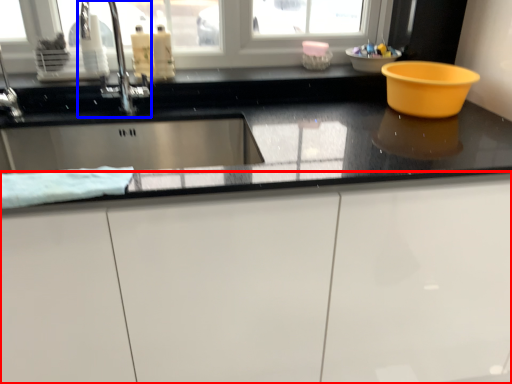
Question: Among these objects, which one is nearest to the camera, cabinetry (highlighted by a red box) or tap (highlighted by a blue box)?

Choices:
 (A) cabinetry
 (B) tap

Answer: (A)